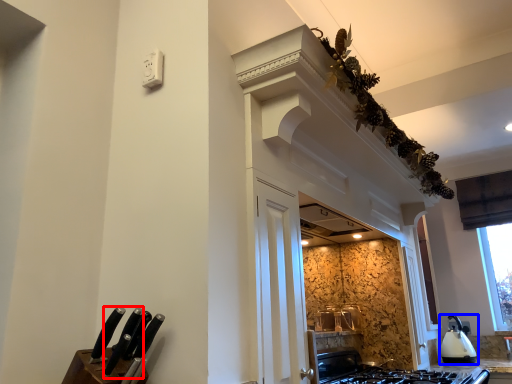
Question: Among these objects, which one is nearest to the camera, knife (highlighted by a red box) or kitchen appliance (highlighted by a blue box)?

Choices:
 (A) knife
 (B) kitchen appliance

Answer: (A)